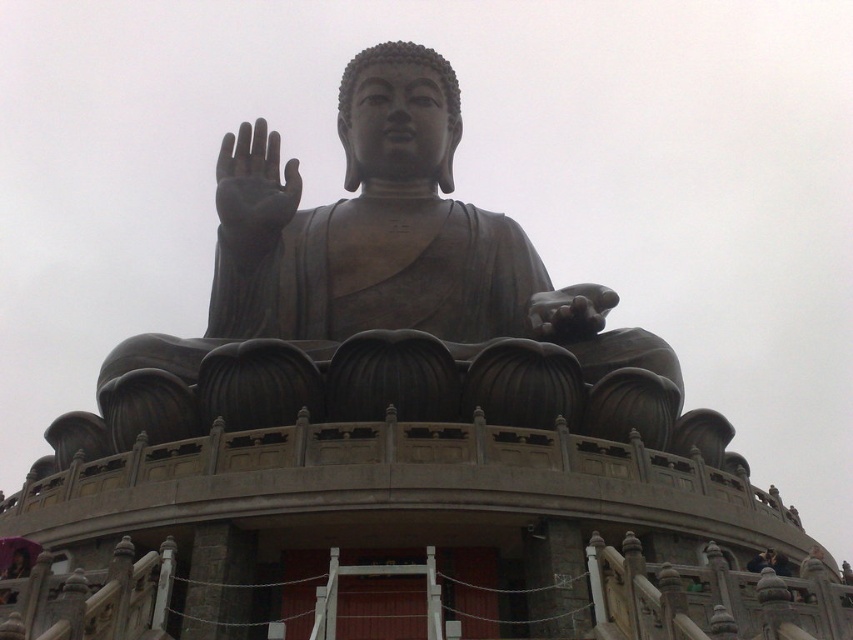
You are standing in front of the seated Buddha statue and notice the bronze statue at center and the black matte hand at upper center. Which object is closer to you?

The bronze statue at center is closer to the viewer than the black matte hand at upper center.